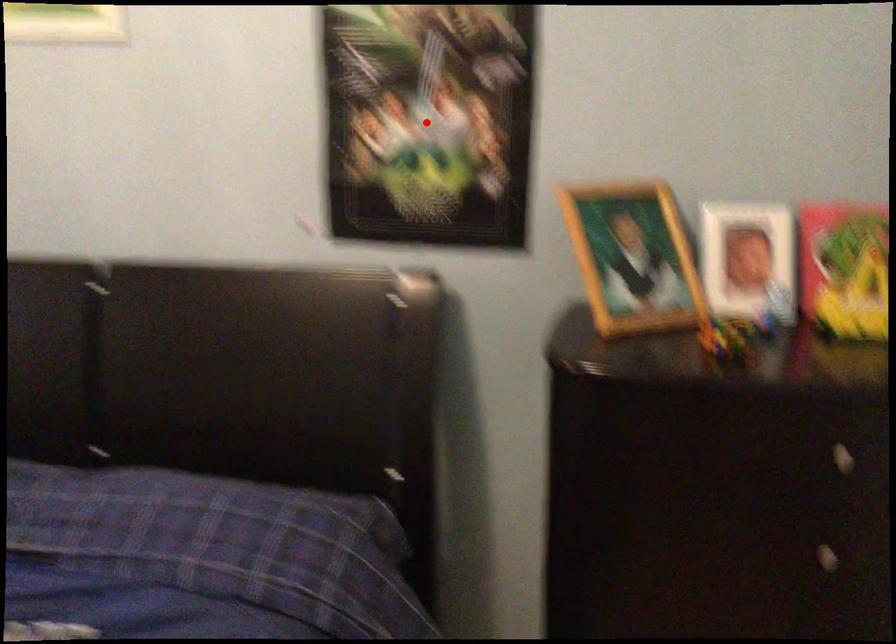
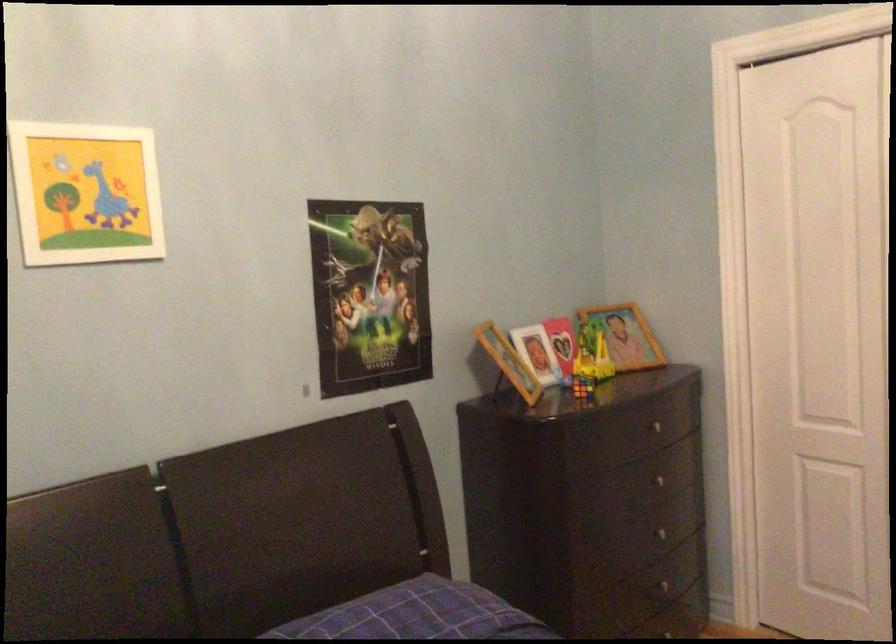
Question: I am providing you with two images of the same scene from different viewpoints. A red point is shown in image1. For the corresponding object point in image2, is it positioned nearer or farther from the camera?

Choices:
 (A) Nearer
 (B) Farther

Answer: (B)